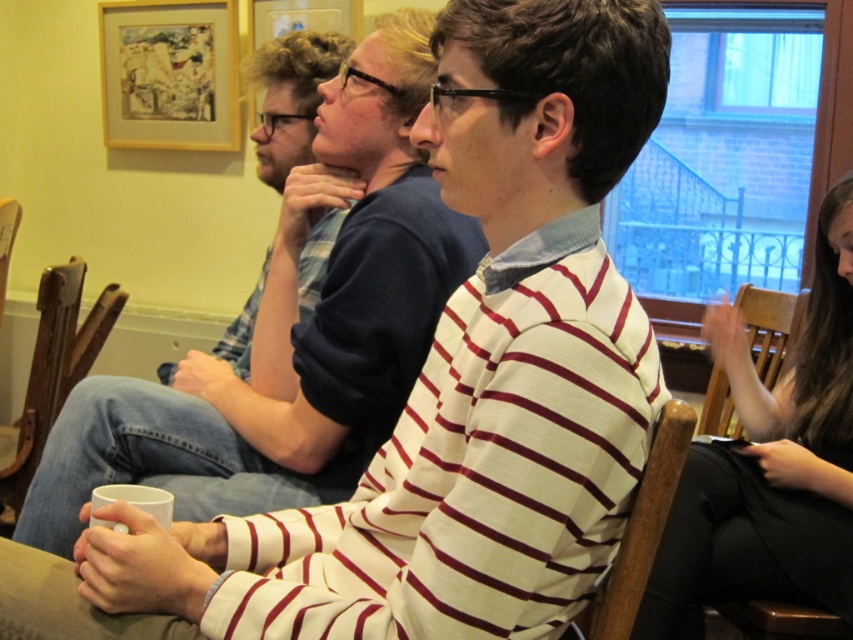
Is wooden chair at center positioned before wooden chair at right?

Yes.

The image size is (853, 640). I want to click on wooden chair at center, so click(641, 528).

Is smooth black hair at right to the left of wooden chair at right from the viewer's perspective?

Correct, you'll find smooth black hair at right to the left of wooden chair at right.

The image size is (853, 640). What do you see at coordinates (769, 465) in the screenshot? I see `smooth black hair at right` at bounding box center [769, 465].

Describe the element at coordinates (769, 465) in the screenshot. This screenshot has width=853, height=640. I see `smooth black hair at right` at that location.

The width and height of the screenshot is (853, 640). I want to click on smooth black hair at right, so coord(769,465).

Consider the image. Can you confirm if brown wooden chair at lower left is bigger than wooden chair at center?

Yes, brown wooden chair at lower left is bigger than wooden chair at center.

The height and width of the screenshot is (640, 853). What do you see at coordinates (55, 365) in the screenshot?
I see `brown wooden chair at lower left` at bounding box center [55, 365].

Is point (33, 387) positioned before point (625, 556)?

No, it is behind (625, 556).

The image size is (853, 640). I want to click on brown wooden chair at lower left, so click(55, 365).